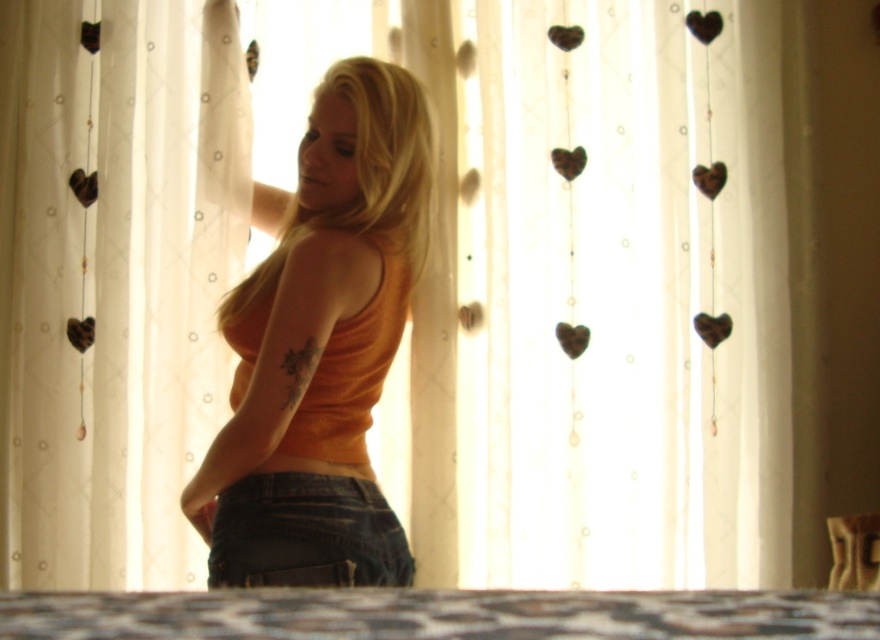
Question: Can you confirm if patterned fabric bed at lower center is thinner than wooden heart at center?

Choices:
 (A) no
 (B) yes

Answer: (A)

Question: Which object is closer to the camera taking this photo?

Choices:
 (A) denim at center
 (B) white sheer curtain at center
 (C) orange matte tank top at center

Answer: (A)

Question: Can you confirm if white sheer curtain at center is wider than orange matte tank top at center?

Choices:
 (A) yes
 (B) no

Answer: (A)

Question: Among these points, which one is farthest from the camera?

Choices:
 (A) (298, 634)
 (B) (697, 164)
 (C) (316, 348)
 (D) (182, 60)

Answer: (B)

Question: Is the position of patterned fabric bed at lower center less distant than that of wooden heart at center?

Choices:
 (A) yes
 (B) no

Answer: (A)

Question: Among these objects, which one is farthest from the camera?

Choices:
 (A) orange matte tank top at center
 (B) white sheer curtain at center
 (C) wooden heart at center
 (D) patterned fabric bed at lower center

Answer: (C)